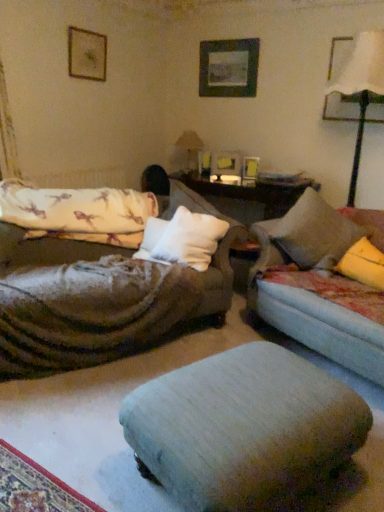
Describe the element at coordinates (361, 87) in the screenshot. I see `white fabric lampshade at upper right, arranged as the 2th table lamp when viewed from the left` at that location.

Locate an element on the screen. light blue fabric couch at right is located at coordinates [x=309, y=290].

What do you see at coordinates (244, 428) in the screenshot? The width and height of the screenshot is (384, 512). I see `light gray fabric footrest at center` at bounding box center [244, 428].

The width and height of the screenshot is (384, 512). I want to click on wooden picture frame at upper left, the fourth picture frame viewed from the right, so click(87, 54).

Where is `wooden picture frame at center, which is the 3th picture frame from right to left`? The height and width of the screenshot is (512, 384). wooden picture frame at center, which is the 3th picture frame from right to left is located at coordinates (226, 163).

This screenshot has width=384, height=512. Identify the location of white fabric lampshade at upper right, which ranks as the 1th table lamp in right-to-left order. (361, 87).

Is white soft pillow at center, which is the 1th pillow from left to right, shorter than light blue fabric couch at right?

Correct, white soft pillow at center, which is the 1th pillow from left to right, is not as tall as light blue fabric couch at right.

Is point (150, 220) more distant than point (328, 208)?

Yes, it is behind point (328, 208).

Is white soft pillow at center, which is the 1th pillow from left to right, positioned in front of light blue fabric couch at right?

No, white soft pillow at center, which is the 1th pillow from left to right, is behind light blue fabric couch at right.

Would you consider matte beige table lamp at center, which is the 1th table lamp from back to front, to be distant from wooden picture frame at upper left, the fourth picture frame viewed from the right?

Result: matte beige table lamp at center, which is the 1th table lamp from back to front, is positioned a significant distance from wooden picture frame at upper left, the fourth picture frame viewed from the right.

From a real-world perspective, is matte beige table lamp at center, the 2th table lamp from the front, positioned under wooden picture frame at upper left, the fourth picture frame viewed from the right, based on gravity?

Indeed, from a real-world perspective, matte beige table lamp at center, the 2th table lamp from the front, is positioned beneath wooden picture frame at upper left, the fourth picture frame viewed from the right.

From the image's perspective, which object appears higher, matte beige table lamp at center, which is the first table lamp in left-to-right order, or wooden picture frame at upper left, the first picture frame viewed from the left?

wooden picture frame at upper left, the first picture frame viewed from the left, is shown above in the image.

Considering the sizes of matte beige table lamp at center, which is the 1th table lamp from back to front, and wooden picture frame at upper left, the fourth picture frame viewed from the right, in the image, is matte beige table lamp at center, which is the 1th table lamp from back to front, taller or shorter than wooden picture frame at upper left, the fourth picture frame viewed from the right,?

Clearly, matte beige table lamp at center, which is the 1th table lamp from back to front, is taller compared to wooden picture frame at upper left, the fourth picture frame viewed from the right.

Does matte black picture frame at upper right, which is the 4th picture frame in left-to-right order, have a lesser width compared to light gray fabric footrest at center?

A: Correct, the width of matte black picture frame at upper right, which is the 4th picture frame in left-to-right order, is less than that of light gray fabric footrest at center.

Looking at this image, would you say matte black picture frame at upper right, which appears as the 1th picture frame when viewed from the right, is inside or outside light gray fabric footrest at center?

matte black picture frame at upper right, which appears as the 1th picture frame when viewed from the right, is not enclosed by light gray fabric footrest at center.

From the image's perspective, which one is positioned lower, matte black picture frame at upper right, which appears as the 1th picture frame when viewed from the right, or light gray fabric footrest at center?

light gray fabric footrest at center is shown below in the image.

From a real-world perspective, is matte black picture frame at upper right, which is the 4th picture frame in left-to-right order, physically above light gray fabric footrest at center?

Yes, from a real-world perspective, matte black picture frame at upper right, which is the 4th picture frame in left-to-right order, is over light gray fabric footrest at center

Is wooden picture frame at upper center, which is the 2th picture frame in right-to-left order, outside of matte black picture frame at upper right, which appears as the 1th picture frame when viewed from the right?

That's correct, wooden picture frame at upper center, which is the 2th picture frame in right-to-left order, is outside of matte black picture frame at upper right, which appears as the 1th picture frame when viewed from the right.

How many degrees apart are the facing directions of wooden picture frame at upper center, which is the 2th picture frame in right-to-left order, and matte black picture frame at upper right, which is the 4th picture frame in left-to-right order?

0.00191 degrees.

Is wooden picture frame at upper center, which is the 2th picture frame in right-to-left order, not close to matte black picture frame at upper right, which is the 4th picture frame in left-to-right order?

Yes.

From the image's perspective, is wooden picture frame at upper center, which is the 2th picture frame in right-to-left order, over matte black picture frame at upper right, which is the 4th picture frame in left-to-right order?

Yes, from the image's perspective, wooden picture frame at upper center, which is the 2th picture frame in right-to-left order, is over matte black picture frame at upper right, which is the 4th picture frame in left-to-right order.

Would you say matte beige table lamp at center, the 2th table lamp from the front, is inside or outside light gray fabric footrest at center?

matte beige table lamp at center, the 2th table lamp from the front, is outside light gray fabric footrest at center.

Between matte beige table lamp at center, which is the first table lamp in left-to-right order, and light gray fabric footrest at center, which one appears on the left side from the viewer's perspective?

Positioned to the left is matte beige table lamp at center, which is the first table lamp in left-to-right order.

In terms of height, does matte beige table lamp at center, the 2th table lamp from the front, look taller or shorter compared to light gray fabric footrest at center?

Clearly, matte beige table lamp at center, the 2th table lamp from the front, is taller compared to light gray fabric footrest at center.

Image resolution: width=384 pixels, height=512 pixels. I want to click on the 1st table lamp above the light gray fabric footrest at center (from a real-world perspective), so click(x=190, y=147).

Who is shorter, light blue fabric couch at right or yellow fabric pillow at right, which is the second pillow from left to right?

With less height is yellow fabric pillow at right, which is the second pillow from left to right.

Considering the relative positions of light blue fabric couch at right and yellow fabric pillow at right, which is the second pillow from left to right, in the image provided, is light blue fabric couch at right to the right of yellow fabric pillow at right, which is the second pillow from left to right, from the viewer's perspective?

No, light blue fabric couch at right is not to the right of yellow fabric pillow at right, which is the second pillow from left to right.

Who is bigger, light blue fabric couch at right or yellow fabric pillow at right, which is the second pillow from left to right?

light blue fabric couch at right.

I want to click on pillow on the right of light blue fabric couch at right, so click(x=363, y=264).

Is light gray fabric footrest at center aimed at white fabric lampshade at upper right, the 1th table lamp positioned from the front?

No, light gray fabric footrest at center is not facing towards white fabric lampshade at upper right, the 1th table lamp positioned from the front.

Is light gray fabric footrest at center far from white fabric lampshade at upper right, the 1th table lamp positioned from the front?

Absolutely, light gray fabric footrest at center is distant from white fabric lampshade at upper right, the 1th table lamp positioned from the front.

Looking at this image, in terms of size, does light gray fabric footrest at center appear bigger or smaller than white fabric lampshade at upper right, the 1th table lamp positioned from the front?

light gray fabric footrest at center is smaller than white fabric lampshade at upper right, the 1th table lamp positioned from the front.

From a real-world perspective, is light gray fabric footrest at center under white fabric lampshade at upper right, arranged as the 2th table lamp when viewed from the left?

Correct, in the physical world, light gray fabric footrest at center is lower than white fabric lampshade at upper right, arranged as the 2th table lamp when viewed from the left.

This screenshot has width=384, height=512. There is a light blue fabric couch at right. Identify the location of the 2nd pillow above it (from the image's perspective). (151, 240).

Where is `table lamp that is the 1st one when counting downward from the wooden picture frame at upper left, the first picture frame viewed from the left (from the image's perspective)`? table lamp that is the 1st one when counting downward from the wooden picture frame at upper left, the first picture frame viewed from the left (from the image's perspective) is located at coordinates (190, 147).

Which object lies further to the anchor point light gray fabric footrest at center, light blue fabric couch at right or wooden picture frame at center, marked as the 2th picture frame in a left-to-right arrangement?

wooden picture frame at center, marked as the 2th picture frame in a left-to-right arrangement.

Based on their spatial positions, is wooden picture frame at center, marked as the 2th picture frame in a left-to-right arrangement, or white soft pillow at center, which is the 1th pillow from left to right, further from light gray fabric footrest at center?

wooden picture frame at center, marked as the 2th picture frame in a left-to-right arrangement, lies further to light gray fabric footrest at center than the other object.

Estimate the real-world distances between objects in this image. Which object is further from yellow fabric pillow at right, which is the second pillow from left to right, wooden picture frame at upper center, the third picture frame positioned from the left, or matte beige table lamp at center, which is the first table lamp in left-to-right order?

Among the two, wooden picture frame at upper center, the third picture frame positioned from the left, is located further to yellow fabric pillow at right, which is the second pillow from left to right.

Estimate the real-world distances between objects in this image. Which object is further from white fabric lampshade at upper right, arranged as the 2th table lamp when viewed from the left, white soft pillow at center, which is the 1th pillow from left to right, or light blue fabric couch at right?

white soft pillow at center, which is the 1th pillow from left to right, is positioned further to the anchor white fabric lampshade at upper right, arranged as the 2th table lamp when viewed from the left.

Based on their spatial positions, is light gray fabric footrest at center or yellow fabric pillow at right, which is the second pillow from left to right, further from fluffy white mattress at left?

light gray fabric footrest at center lies further to fluffy white mattress at left than the other object.

From the image, which object appears to be nearer to white soft cushion at center, yellow fabric pillow at right, acting as the 1th pillow starting from the right, or light gray fabric footrest at center?

yellow fabric pillow at right, acting as the 1th pillow starting from the right.

Looking at the image, which one is located closer to light gray fabric footrest at center, matte black picture frame at upper right, which appears as the 1th picture frame when viewed from the right, or light blue fabric couch at right?

The object closer to light gray fabric footrest at center is light blue fabric couch at right.

Estimate the real-world distances between objects in this image. Which object is closer to white fabric lampshade at upper right, which ranks as the 1th table lamp in right-to-left order, yellow fabric pillow at right, which is the second pillow from left to right, or white soft pillow at center, which is the 1th pillow from left to right?

yellow fabric pillow at right, which is the second pillow from left to right, is positioned closer to the anchor white fabric lampshade at upper right, which ranks as the 1th table lamp in right-to-left order.

Where is `studio couch between white soft cushion at center and white fabric lampshade at upper right, the 1th table lamp positioned from the front, in the horizontal direction`? This screenshot has height=512, width=384. studio couch between white soft cushion at center and white fabric lampshade at upper right, the 1th table lamp positioned from the front, in the horizontal direction is located at coordinates (309, 290).

This screenshot has height=512, width=384. In order to click on studio couch between fluffy white mattress at left and matte black picture frame at upper right, which appears as the 1th picture frame when viewed from the right, in the horizontal direction in this screenshot , I will do `click(309, 290)`.

Find the location of a particular element. throw pillow positioned between yellow fabric pillow at right, which is the second pillow from left to right, and wooden picture frame at center, which is the 3th picture frame from right to left, from near to far is located at coordinates (190, 239).

The height and width of the screenshot is (512, 384). What are the coordinates of `table lamp between light gray fabric footrest at center and matte beige table lamp at center, which is the second table lamp from right to left, along the z-axis` in the screenshot? It's located at (361, 87).